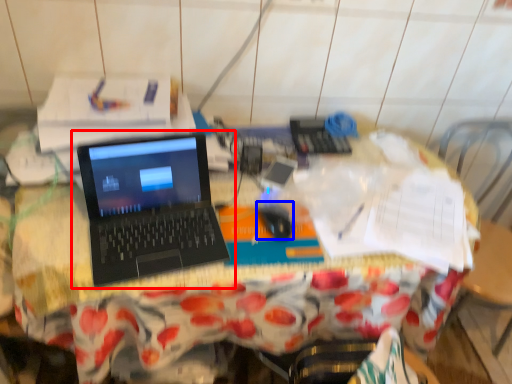
Question: Which point is closer to the camera, laptop (highlighted by a red box) or mouse (highlighted by a blue box)?

Choices:
 (A) laptop
 (B) mouse

Answer: (A)